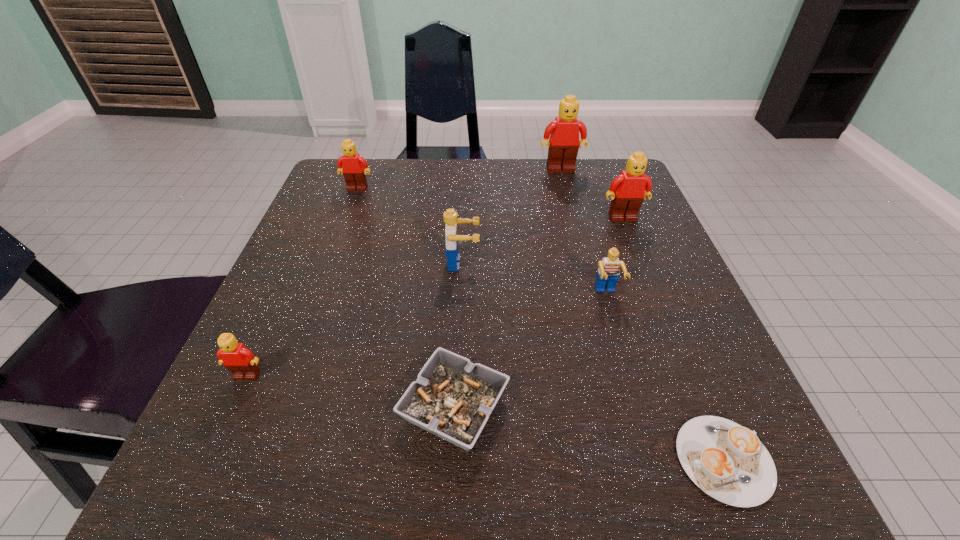
Identify the location of free location located 0.280m on the face of the right blue Lego. The width and height of the screenshot is (960, 540). (657, 467).

Identify the location of free space located 0.090m on the face of the smallest brown Lego. The height and width of the screenshot is (540, 960). (217, 441).

You are a GUI agent. You are given a task and a screenshot of the screen. Output one action in this format:
    pyautogui.click(x=<x>, y=<y>)
    Task: Click on the vacant space located on the back of the ashtray
    
    Given the screenshot: What is the action you would take?
    pyautogui.click(x=461, y=265)

Find the location of a particular element. This screenshot has height=540, width=960. vacant area situated 0.100m on the back of the shortest object is located at coordinates (683, 357).

The image size is (960, 540). What are the coordinates of `ashtray situated at the near edge` in the screenshot? It's located at (452, 398).

In order to click on cappuccino at the near edge in this screenshot , I will do `click(727, 461)`.

The width and height of the screenshot is (960, 540). What are the coordinates of `cappuccino at the right edge` in the screenshot? It's located at (727, 461).

Where is `object positioned at the far left corner`? object positioned at the far left corner is located at coordinates (353, 166).

Locate an element on the screen. This screenshot has width=960, height=540. object that is at the near right corner is located at coordinates (727, 461).

Locate an element on the screen. Image resolution: width=960 pixels, height=540 pixels. vacant space at the far edge is located at coordinates (484, 180).